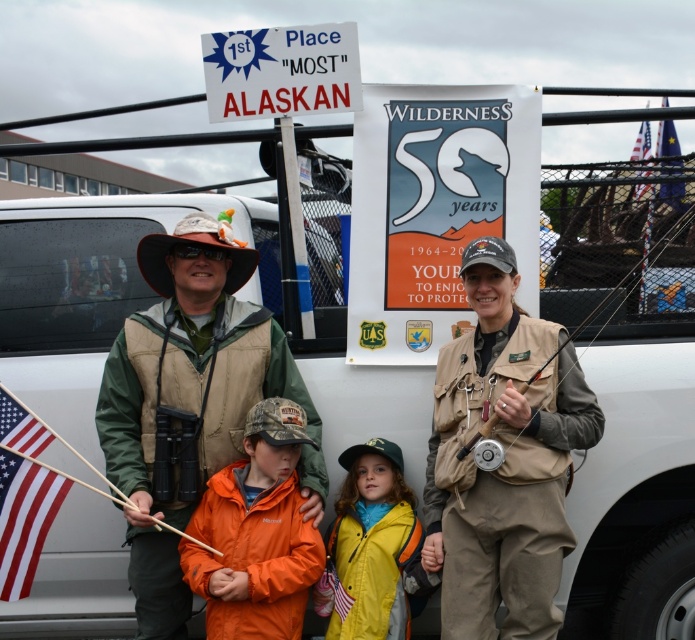
You are standing at the point marked as point (220,374). You want to walk to the banner celebrating Wilderness 50 years. Which direction should you head towards?

The banner celebrating Wilderness 50 years is located behind the group of four individuals, so you should head towards the direction away from the vehicle to reach it.

Based on the scene description, can you determine which object is taller between the tan fabric vest at center and the metallic plastic sign at upper center?

The tan fabric vest at center is much taller than the metallic plastic sign at upper center.